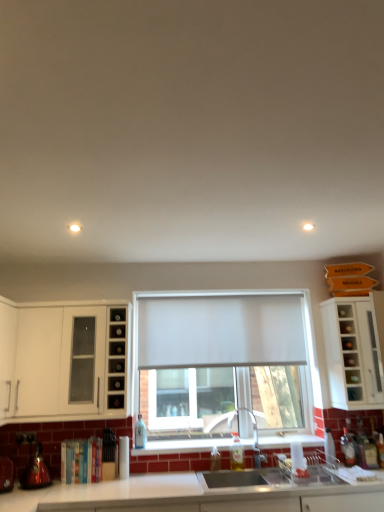
Question: In terms of width, does white matte curtain at center look wider or thinner when compared to clear glass bottle at lower right, the fourth bottle positioned from the left?

Choices:
 (A) wide
 (B) thin

Answer: (A)

Question: Based on their sizes in the image, would you say white matte curtain at center is bigger or smaller than clear glass bottle at lower right, the fourth bottle positioned from the left?

Choices:
 (A) small
 (B) big

Answer: (B)

Question: Which of these objects is positioned farthest from the white matte curtain at center?

Choices:
 (A) clear glass bottle at center, which is counted as the 6th bottle, starting from the right
 (B) translucent glass bottle at lower right, which appears as the sixth bottle when viewed from the left
 (C) matte glass shelf at lower left
 (D) clear glass bottle at lower right, the fourth bottle positioned from the left
 (E) matte stainless steel sink at lower center

Answer: (B)

Question: Which is nearer to the white matte window sill at center?

Choices:
 (A) clear glass bottle at center, which is counted as the 6th bottle, starting from the right
 (B) matte glass shelf at lower left
 (C) white glossy cabinet at left, which is the 1th cabinetry in left-to-right order
 (D) translucent glass bottle at lower center, the 2th bottle viewed from the left
 (E) clear glass bottle at lower right, the fourth bottle positioned from the left

Answer: (D)